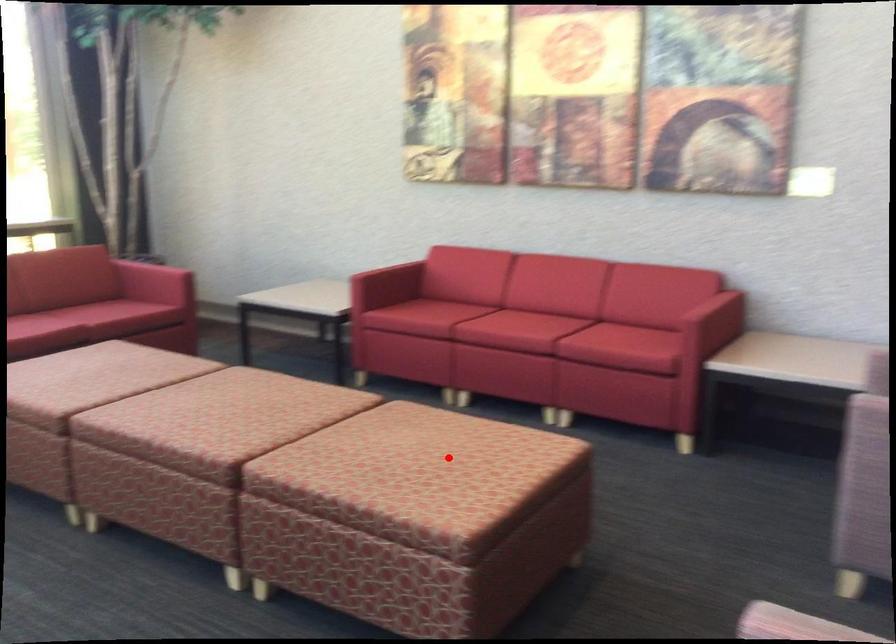
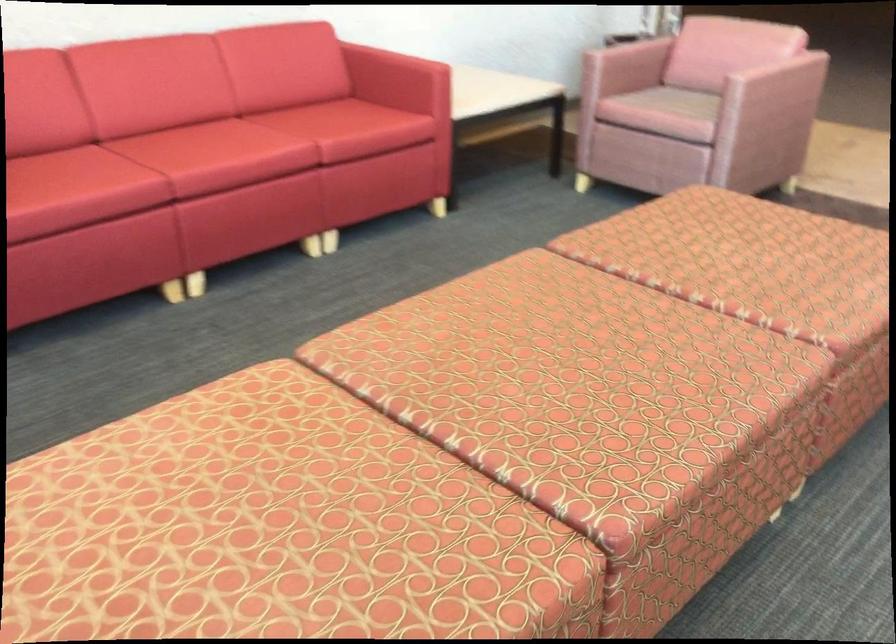
Question: I am providing you with two images of the same scene from different viewpoints. A red point is marked on the first image. At the location where the point appears in image 1, is it still visible in image 2?

Choices:
 (A) Yes
 (B) No

Answer: (A)